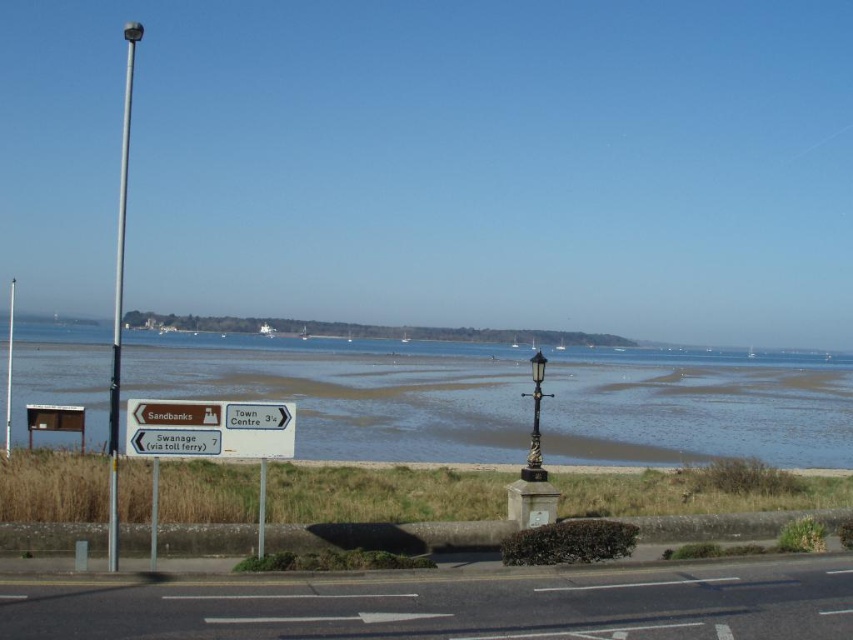
Does point (566, 349) lie behind point (318, 484)?

Yes, it is.

Can you confirm if clear water at lower center is positioned above brown sand at lower center?

No.

Locate an element on the screen. This screenshot has width=853, height=640. clear water at lower center is located at coordinates (352, 392).

Does brown wooden sign at left appear under brushed metal pole at center?

Actually, brown wooden sign at left is above brushed metal pole at center.

Where is `brown wooden sign at left`? This screenshot has width=853, height=640. brown wooden sign at left is located at coordinates 209,429.

In the scene shown: Does silver metallic pole at left have a greater width compared to polished brass lamp post at center?

Yes.

Image resolution: width=853 pixels, height=640 pixels. I want to click on silver metallic pole at left, so click(119, 300).